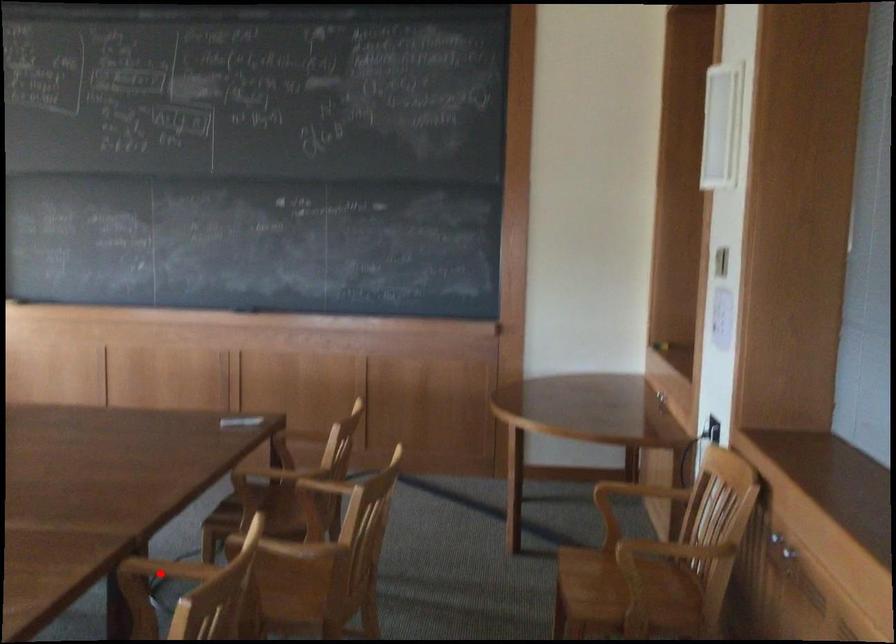
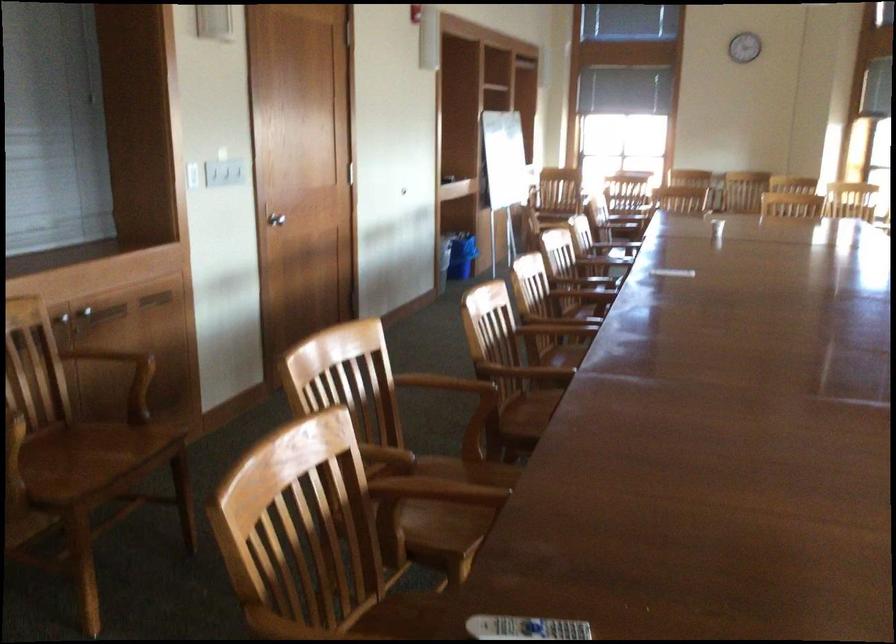
Question: I am providing you with two images of the same scene from different viewpoints. A red point is marked on the first image. At the location where the point appears in image 1, is it still visible in image 2?

Choices:
 (A) Yes
 (B) No

Answer: (B)